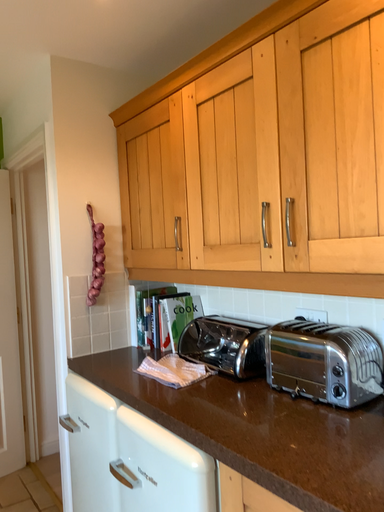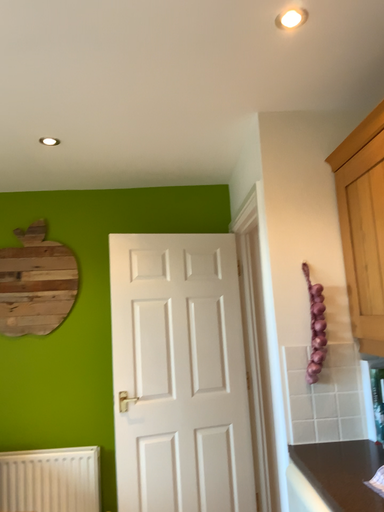
Question: Which way did the camera rotate in the video?

Choices:
 (A) rotated downward
 (B) rotated upward

Answer: (B)